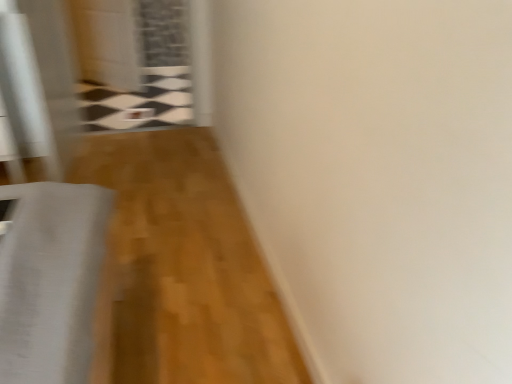
What is the approximate width of clear glass screen door at upper left?

It is 8.57 inches.

This screenshot has width=512, height=384. Describe the element at coordinates (133, 61) in the screenshot. I see `clear glass screen door at upper left` at that location.

The image size is (512, 384). I want to click on clear glass screen door at upper left, so click(133, 61).

Image resolution: width=512 pixels, height=384 pixels. I want to click on clear glass screen door at upper left, so click(x=133, y=61).